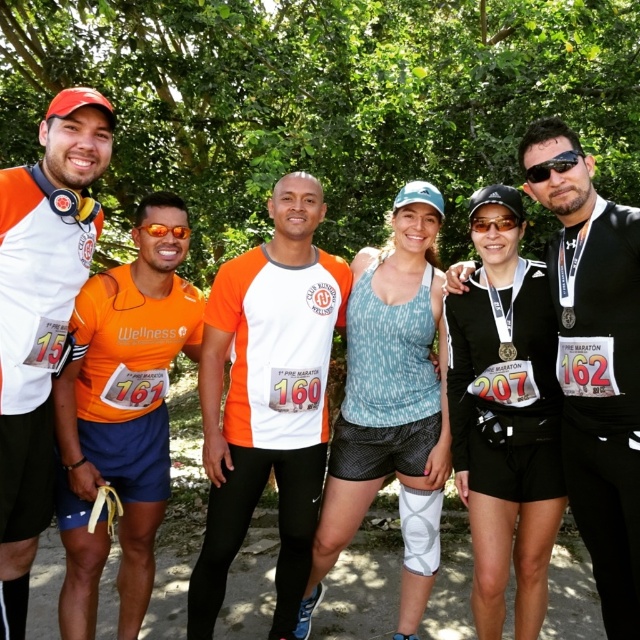
Question: Among these objects, which one is nearest to the camera?

Choices:
 (A) gold metallic medal at center
 (B) orange fabric shirt at center
 (C) black matte sunglasses at center

Answer: (A)

Question: Which object is positioned closest to the gold metallic medal at center?

Choices:
 (A) black matte sunglasses at upper right
 (B) orange matte shirt at left

Answer: (A)

Question: Is orange matte shirt at left bigger than black matte sunglasses at center?

Choices:
 (A) yes
 (B) no

Answer: (A)

Question: Can you confirm if orange matte shirt at left is thinner than black matte sunglasses at upper right?

Choices:
 (A) no
 (B) yes

Answer: (A)

Question: Which object appears farthest from the camera in this image?

Choices:
 (A) gold metallic medal at center
 (B) textured orange tank top at center
 (C) black matte sunglasses at center
 (D) black matte jacket at center

Answer: (B)

Question: Does black matte jacket at center appear on the right side of black matte sunglasses at upper right?

Choices:
 (A) no
 (B) yes

Answer: (B)